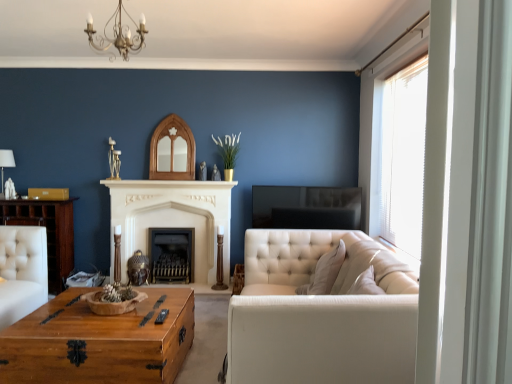
Question: Can you confirm if white fabric lampshade at left is positioned to the left of wooden trunk at left?

Choices:
 (A) yes
 (B) no

Answer: (A)

Question: Is white fabric lampshade at left oriented away from wooden trunk at left?

Choices:
 (A) yes
 (B) no

Answer: (B)

Question: From a real-world perspective, is white fabric lampshade at left under wooden trunk at left?

Choices:
 (A) no
 (B) yes

Answer: (A)

Question: Is white fabric lampshade at left at the right side of wooden trunk at left?

Choices:
 (A) yes
 (B) no

Answer: (B)

Question: Can you confirm if white fabric lampshade at left is shorter than wooden trunk at left?

Choices:
 (A) no
 (B) yes

Answer: (B)

Question: Considering the relative sizes of white fabric lampshade at left and wooden trunk at left in the image provided, is white fabric lampshade at left wider than wooden trunk at left?

Choices:
 (A) yes
 (B) no

Answer: (B)

Question: Is black metal fireplace at center, the 2th fireplace from the front, inside wooden trunk at left?

Choices:
 (A) no
 (B) yes

Answer: (A)

Question: Can we say wooden trunk at left lies outside black metal fireplace at center, the 2th fireplace from the front?

Choices:
 (A) yes
 (B) no

Answer: (A)

Question: Can you confirm if wooden trunk at left is wider than black metal fireplace at center, the 2th fireplace from the front?

Choices:
 (A) yes
 (B) no

Answer: (A)

Question: From a real-world perspective, does wooden trunk at left sit lower than black metal fireplace at center, positioned as the first fireplace in back-to-front order?

Choices:
 (A) yes
 (B) no

Answer: (B)

Question: From the image's perspective, is wooden trunk at left on black metal fireplace at center, positioned as the first fireplace in back-to-front order?

Choices:
 (A) no
 (B) yes

Answer: (B)

Question: Is wooden trunk at left taller than black metal fireplace at center, the 2th fireplace from the front?

Choices:
 (A) yes
 (B) no

Answer: (A)

Question: Is wooden coffee table at center positioned far away from white stone fireplace at center, which ranks as the second fireplace in back-to-front order?

Choices:
 (A) no
 (B) yes

Answer: (B)